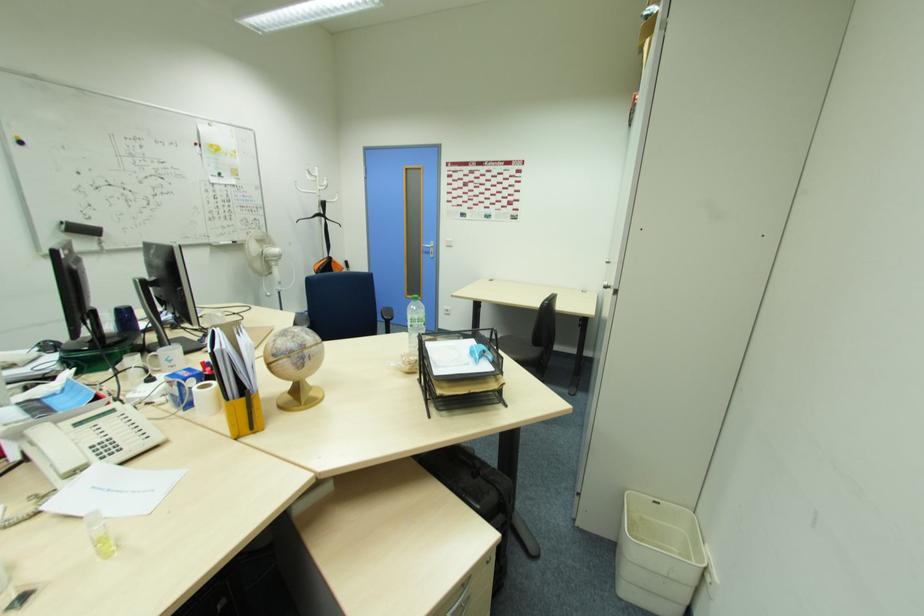
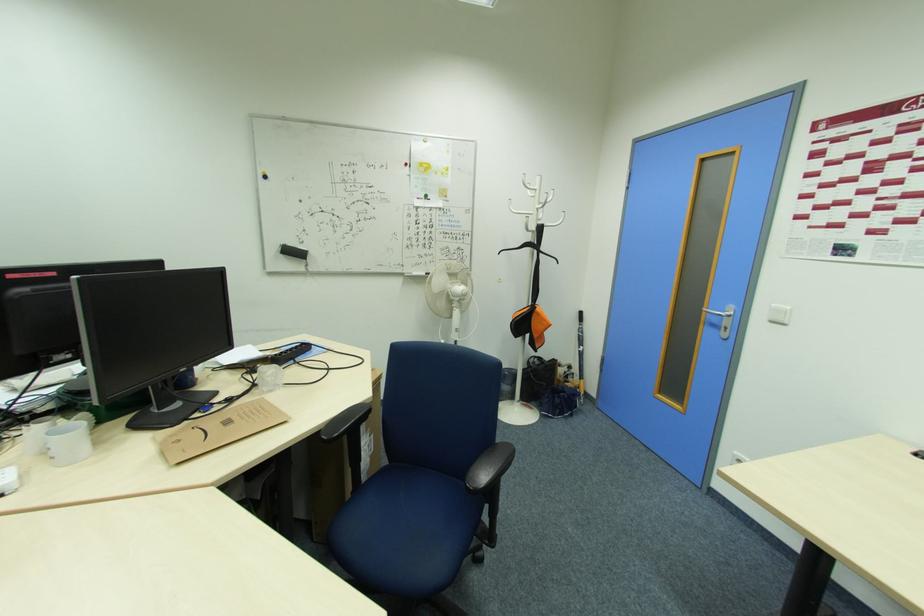
Find the pixel in the second image that matches point 433,246 in the first image.

(727, 313)